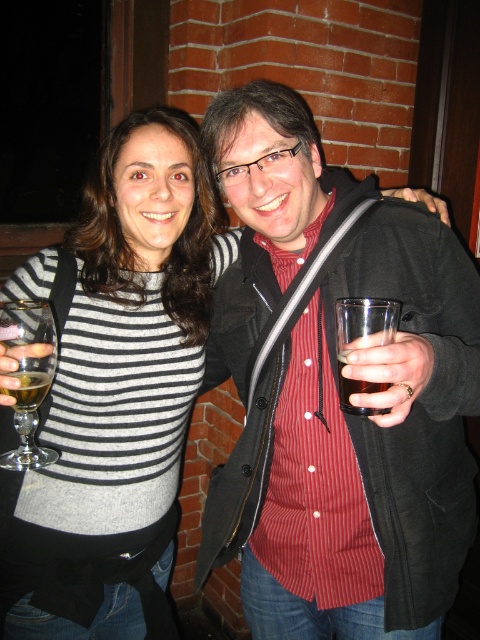
You are a photographer setting up a camera to capture the two people in the scene. You need to ensure that both the striped knit sweater at center and the red striped shirt at center are fully visible in the frame. Based on their positions, which clothing item might require you to adjust the camera angle to avoid being cut off?

The striped knit sweater at center might be wider than the red striped shirt at center, so it could require adjusting the camera angle to ensure it fits entirely within the frame.